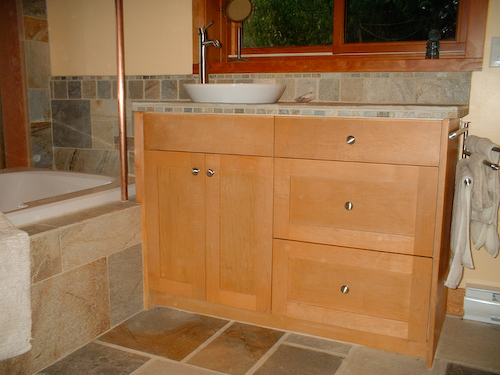
You are a GUI agent. You are given a task and a screenshot of the screen. Output one action in this format:
    pyautogui.click(x=<x>, y=<y>)
    Task: Click on the window
    Image resolution: width=500 pixels, height=375 pixels.
    Given the screenshot: What is the action you would take?
    pyautogui.click(x=338, y=39)